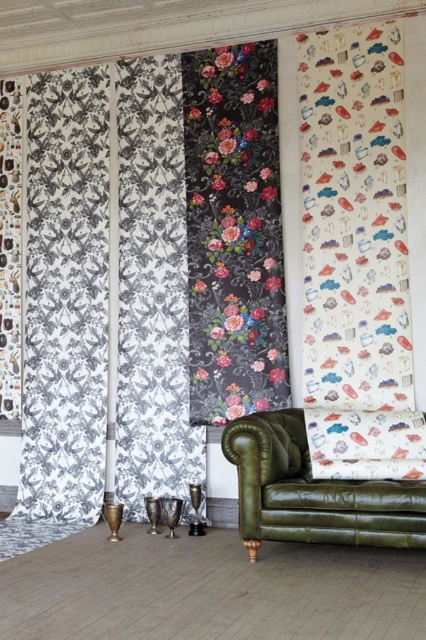
You are standing in the room with the wallpaper samples. You need to locate the black and white patterned fabric at left. According to the coordinates provided, where exactly is it positioned on the wall?

The black and white patterned fabric at left is positioned at coordinates point (x=106, y=292) on the wall.

You are an interior designer planning to place a new lamp on the wall. The lamp requires a space that is not covered by either the white paper with colorful illustrations at right or the olive green leather armchair at lower right. Based on the scene, where could you place the lamp?

The lamp could be placed below the white paper with colorful illustrations at right since it is located above the olive green leather armchair at lower right, leaving space below the paper and above the armchair free.